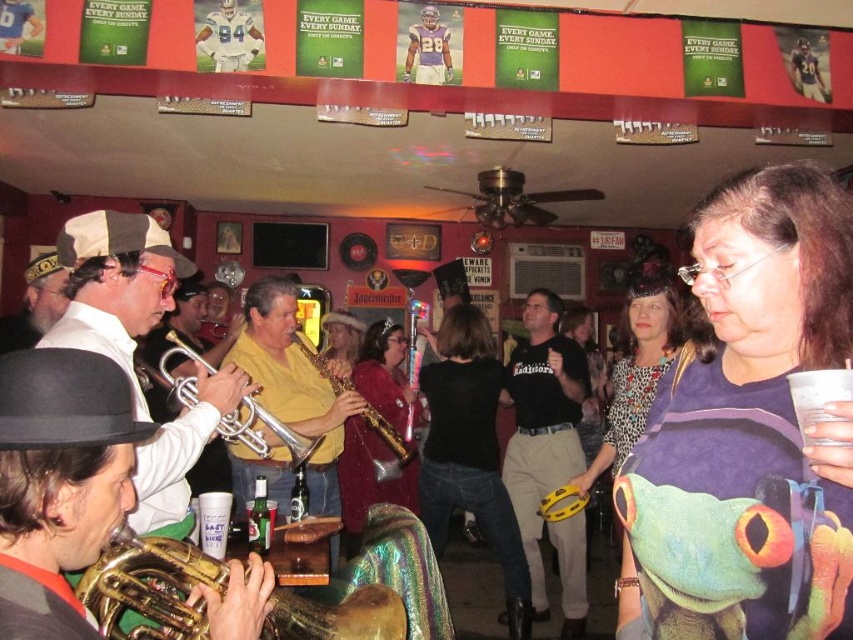
Consider the image. Does black matte t-shirt at center appear under gold shiny saxophone at center?

Yes.

Who is lower down, black matte t-shirt at center or gold shiny saxophone at center?

black matte t-shirt at center is lower down.

Is point (583, 602) positioned after point (247, 296)?

Yes, it is.

This screenshot has height=640, width=853. I want to click on black matte t-shirt at center, so click(x=541, y=424).

Between purple printed shirt at center and matte gold trumpet at left, which one is positioned lower?

Positioned lower is purple printed shirt at center.

Can you confirm if purple printed shirt at center is positioned below matte gold trumpet at left?

Yes, purple printed shirt at center is below matte gold trumpet at left.

Between point (695, 376) and point (138, 326), which one is positioned in front?

Point (695, 376) is in front.

This screenshot has width=853, height=640. Identify the location of purple printed shirt at center. (749, 429).

Is point (235, 388) farther from camera compared to point (403, 490)?

No, (235, 388) is closer to viewer.

Is matte gold trumpet at left positioned behind shiny gold saxophone at center?

No, matte gold trumpet at left is in front of shiny gold saxophone at center.

Who is more forward, (138, 468) or (383, 356)?

Point (138, 468)

Image resolution: width=853 pixels, height=640 pixels. Find the location of `matte gold trumpet at left`. matte gold trumpet at left is located at coordinates (115, 285).